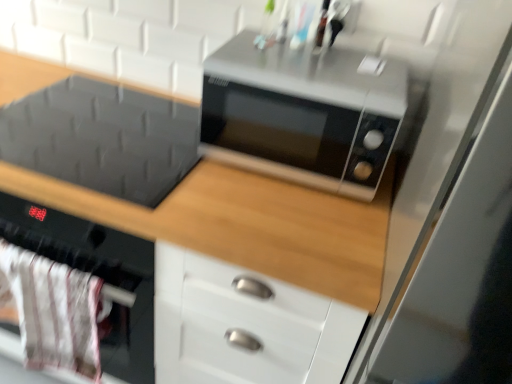
At what (x,y) coordinates should I click in order to perform the action: click on satin silver microwave at center. Please return your answer as a coordinate pair (x, y). Image resolution: width=512 pixels, height=384 pixels. Looking at the image, I should click on (303, 113).

From a real-world perspective, which is physically below, white fabric oven at lower left or matte black microwave at upper center?

matte black microwave at upper center is physically lower.

Does white fabric oven at lower left appear on the left side of matte black microwave at upper center?

Indeed, white fabric oven at lower left is positioned on the left side of matte black microwave at upper center.

Which of these two, white fabric oven at lower left or matte black microwave at upper center, is wider?

matte black microwave at upper center is wider.

Is point (142, 353) positioned in front of point (280, 256)?

No.

Does white fabric oven at lower left touch satin silver microwave at center?

No, white fabric oven at lower left is not next to satin silver microwave at center.

Find the location of a particular element. The width and height of the screenshot is (512, 384). oven below the satin silver microwave at center (from the image's perspective) is located at coordinates (96, 275).

Which is correct: white fabric oven at lower left is inside satin silver microwave at center, or outside of it?

white fabric oven at lower left is outside satin silver microwave at center.

Considering the relative positions of white fabric oven at lower left and satin silver microwave at center in the image provided, is white fabric oven at lower left to the left of satin silver microwave at center from the viewer's perspective?

Correct, you'll find white fabric oven at lower left to the left of satin silver microwave at center.

Does satin silver microwave at center appear on the right side of transparent glass door at right?

Incorrect, satin silver microwave at center is not on the right side of transparent glass door at right.

Does point (332, 109) come farther from viewer compared to point (472, 14)?

Yes, it is behind point (472, 14).

Relative to transparent glass door at right, is satin silver microwave at center in front or behind?

Clearly, satin silver microwave at center is behind transparent glass door at right.

From the image's perspective, who appears lower, satin silver microwave at center or transparent glass door at right?

transparent glass door at right.

From a real-world perspective, which object stands above the other?

white fabric oven at lower left.

Is matte black microwave at upper center positioned beyond the bounds of white fabric oven at lower left?

matte black microwave at upper center is positioned outside white fabric oven at lower left.

This screenshot has width=512, height=384. In the image, there is a white fabric oven at lower left. Identify the location of cabinetry below it (from a real-world perspective). (246, 224).

Which point is more forward, (x=336, y=252) or (x=121, y=356)?

The point (x=336, y=252) is more forward.

Is satin silver microwave at center completely or partially outside of white fabric oven at lower left?

Absolutely, satin silver microwave at center is external to white fabric oven at lower left.

In terms of width, does satin silver microwave at center look wider or thinner when compared to white fabric oven at lower left?

Considering their sizes, satin silver microwave at center looks broader than white fabric oven at lower left.

Consider the image. Which point is more distant from viewer, (268,144) or (77,258)?

Point (77,258)

Could you tell me if satin silver microwave at center is turned towards white fabric oven at lower left?

No, satin silver microwave at center does not turn towards white fabric oven at lower left.

Is white fabric oven at lower left completely or partially outside of transparent glass door at right?

Yes.

Between white fabric oven at lower left and transparent glass door at right, which one has larger width?

Wider between the two is transparent glass door at right.

Would you say white fabric oven at lower left is a long distance from transparent glass door at right?

They are positioned close to each other.

Is white fabric oven at lower left looking in the opposite direction of transparent glass door at right?

That's not correct — white fabric oven at lower left is not looking away from transparent glass door at right.

Based on the photo, which object is more forward, satin silver microwave at center or matte black microwave at upper center?

matte black microwave at upper center is more forward.

Which is closer to the camera, (260, 163) or (24, 77)?

Clearly, point (260, 163) is closer to the camera than point (24, 77).

Does satin silver microwave at center appear on the left side of matte black microwave at upper center?

Incorrect, satin silver microwave at center is not on the left side of matte black microwave at upper center.

Are satin silver microwave at center and matte black microwave at upper center beside each other?

satin silver microwave at center and matte black microwave at upper center are not in contact.

This screenshot has width=512, height=384. I want to click on cabinetry that is in front of the white fabric oven at lower left, so click(x=246, y=224).

The width and height of the screenshot is (512, 384). Find the location of `oven on the left of satin silver microwave at center`. oven on the left of satin silver microwave at center is located at coordinates (x=96, y=275).

Looking at the image, which one is located closer to satin silver microwave at center, matte black microwave at upper center or white fabric oven at lower left?

matte black microwave at upper center is positioned closer to the anchor satin silver microwave at center.

Looking at the image, which one is located further to white fabric oven at lower left, matte black microwave at upper center or transparent glass door at right?

Based on the image, transparent glass door at right appears to be further to white fabric oven at lower left.

Looking at the image, which one is located closer to transparent glass door at right, white fabric oven at lower left or matte black microwave at upper center?

The object closer to transparent glass door at right is matte black microwave at upper center.

Which object lies nearer to the anchor point white fabric oven at lower left, matte black microwave at upper center or satin silver microwave at center?

matte black microwave at upper center is positioned closer to the anchor white fabric oven at lower left.

Which object lies nearer to the anchor point satin silver microwave at center, white fabric oven at lower left or transparent glass door at right?

Based on the image, transparent glass door at right appears to be nearer to satin silver microwave at center.

Looking at this image, estimate the real-world distances between objects in this image. Which object is closer to satin silver microwave at center, transparent glass door at right or white fabric oven at lower left?

transparent glass door at right is positioned closer to the anchor satin silver microwave at center.

Estimate the real-world distances between objects in this image. Which object is further from white fabric oven at lower left, transparent glass door at right or satin silver microwave at center?

transparent glass door at right.

Which object lies further to the anchor point transparent glass door at right, white fabric oven at lower left or satin silver microwave at center?

white fabric oven at lower left lies further to transparent glass door at right than the other object.

Find the location of a particular element. This screenshot has width=512, height=384. cabinetry situated between white fabric oven at lower left and transparent glass door at right from left to right is located at coordinates (246, 224).

I want to click on cabinetry between white fabric oven at lower left and satin silver microwave at center in the horizontal direction, so click(246, 224).

Identify the location of microwave oven located between white fabric oven at lower left and transparent glass door at right in the left-right direction. (303, 113).

Locate an element on the screen. microwave oven between matte black microwave at upper center and transparent glass door at right from left to right is located at coordinates coord(303,113).